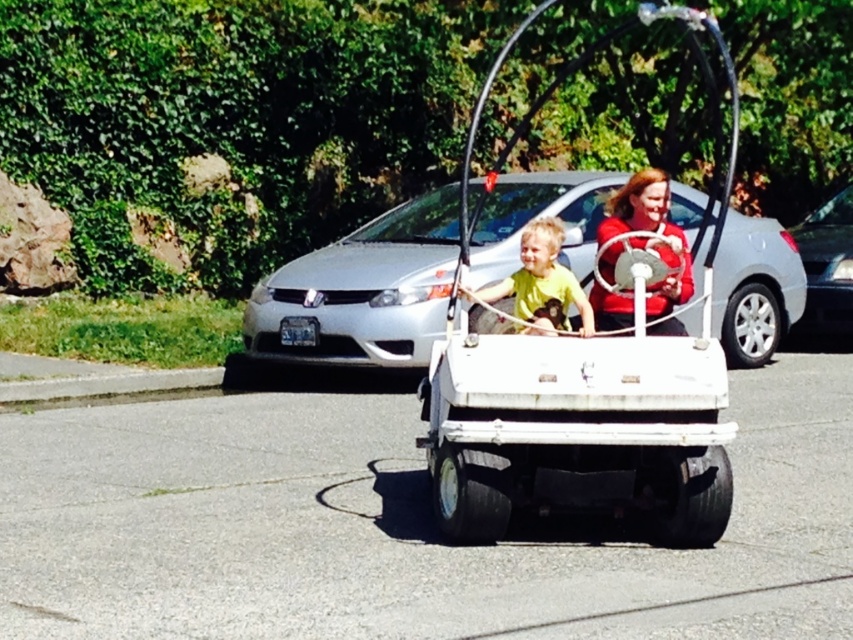
Question: Observing the image, what is the correct spatial positioning of matte red shirt at center in reference to yellow matte shirt at center?

Choices:
 (A) right
 (B) left

Answer: (A)

Question: Which of these objects is positioned farthest from the yellow matte shirt at center?

Choices:
 (A) matte red shirt at center
 (B) white matte car at center
 (C) silver metallic sedan at center

Answer: (C)

Question: Among these points, which one is nearest to the camera?

Choices:
 (A) (631, 228)
 (B) (837, 196)

Answer: (A)

Question: Is matte red shirt at center positioned before silver metallic sedan at center?

Choices:
 (A) yes
 (B) no

Answer: (A)

Question: Based on their relative distances, which object is nearer to the matte red shirt at center?

Choices:
 (A) white matte golf cart at center
 (B) white matte car at center

Answer: (A)

Question: Does white matte golf cart at center have a larger size compared to white matte car at center?

Choices:
 (A) no
 (B) yes

Answer: (A)